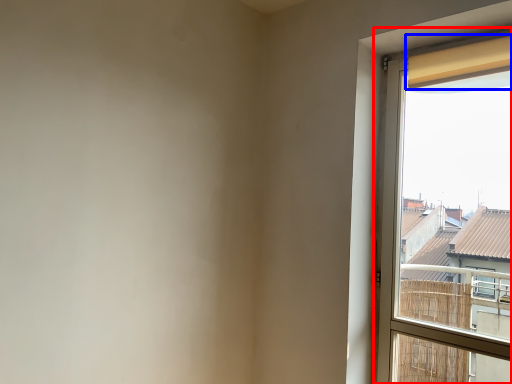
Question: Which of the following is the closest to the observer, window (highlighted by a red box) or curtain (highlighted by a blue box)?

Choices:
 (A) window
 (B) curtain

Answer: (A)